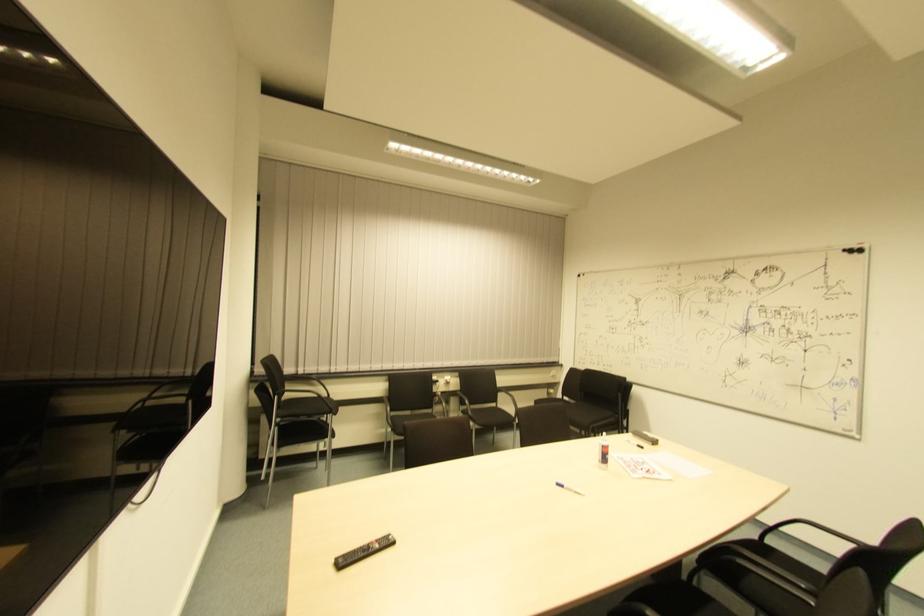
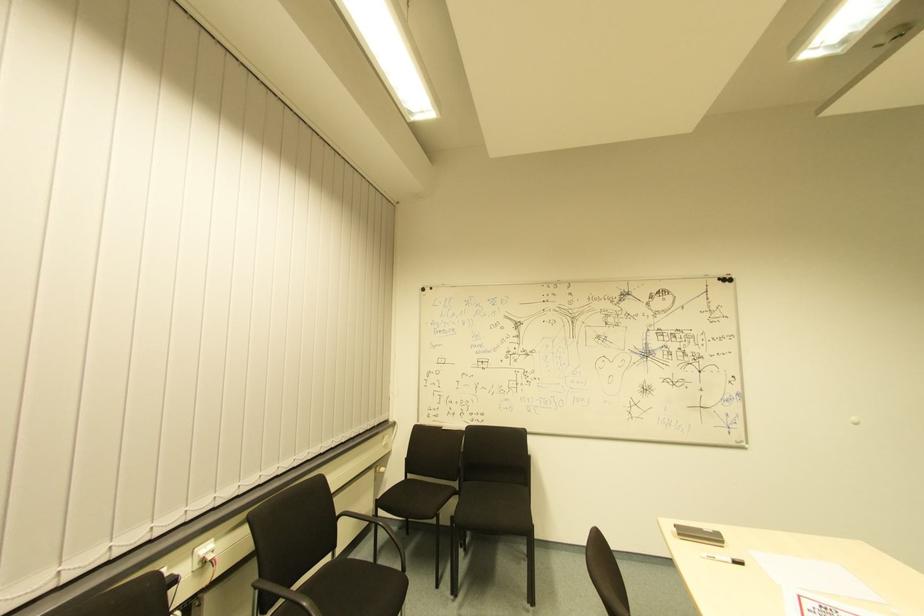
Find the pixel in the second image that matches the point at 564,400 in the first image.

(408, 479)